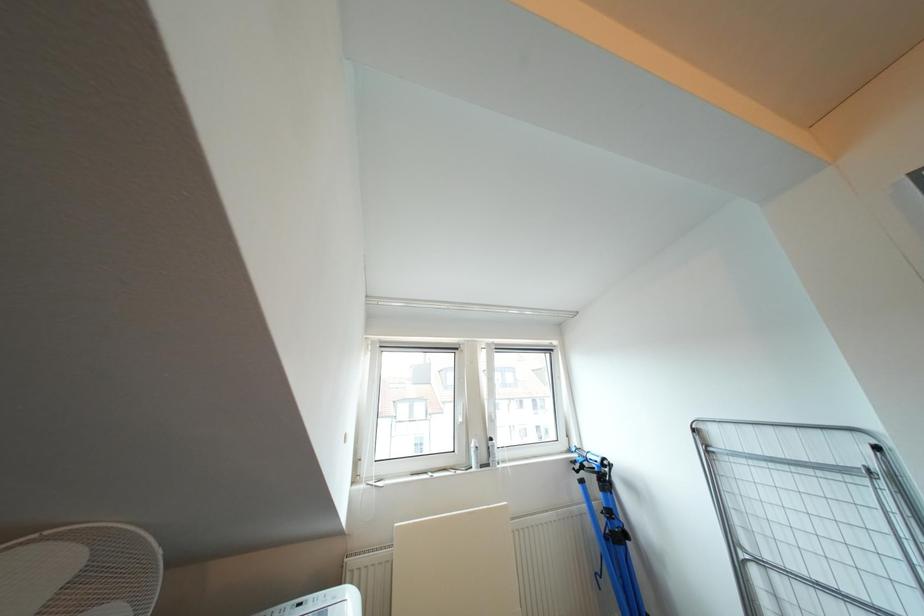
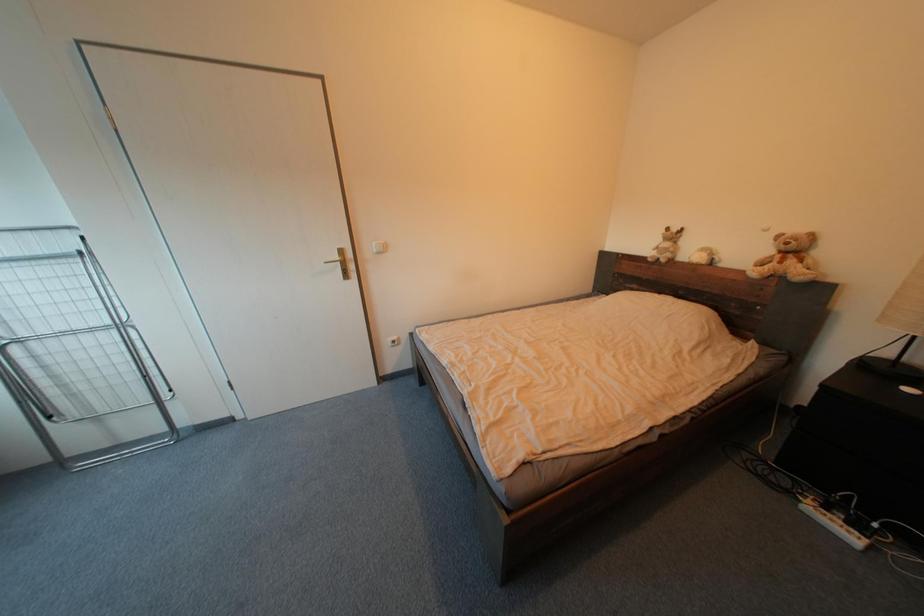
How did the camera likely rotate?

The camera's rotation is toward right-down.